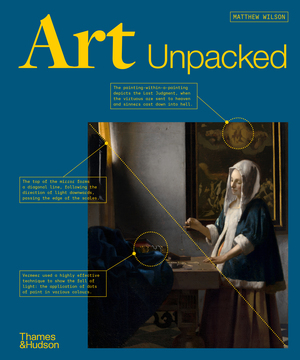
Where is `wall`? Image resolution: width=300 pixels, height=360 pixels. wall is located at coordinates (155, 158).